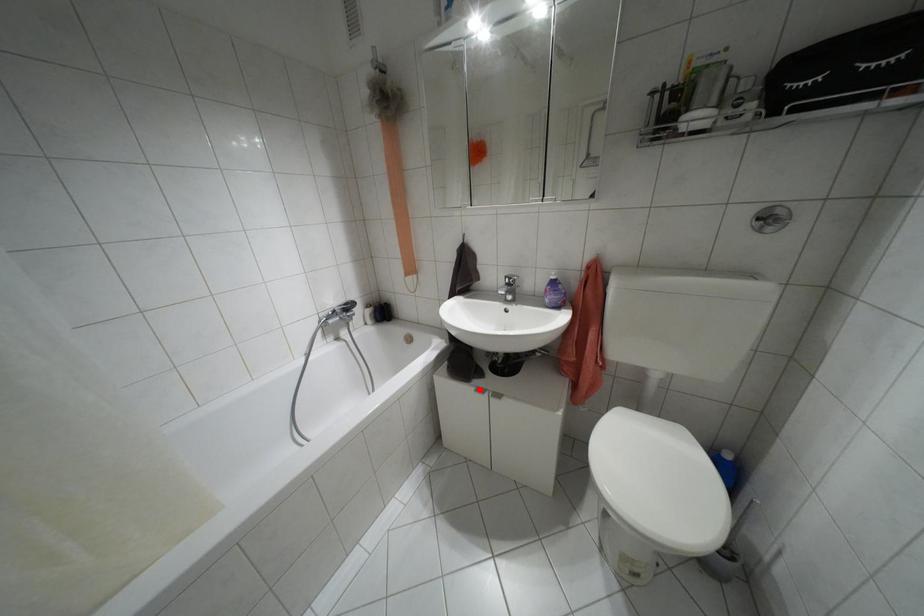
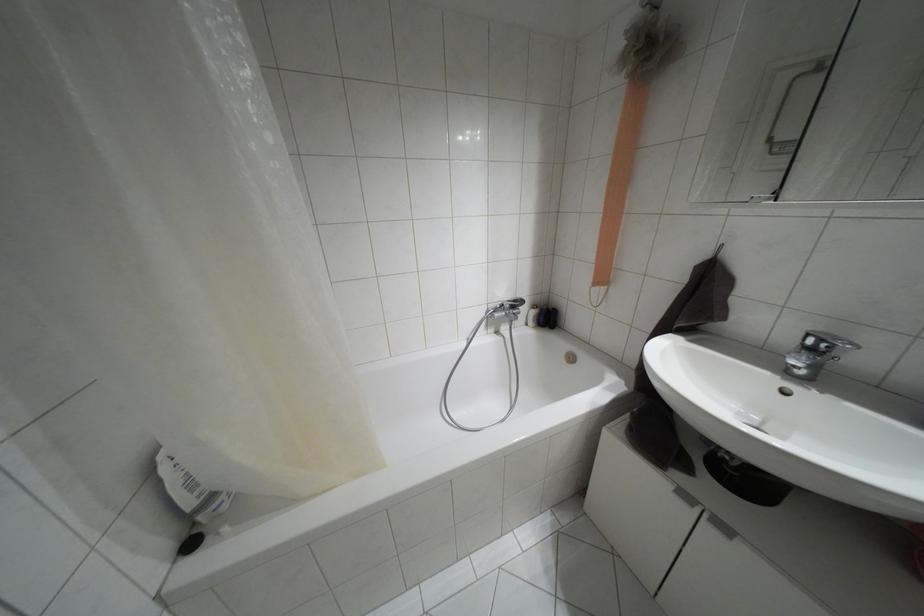
In the second image, find the point that corresponds to the highlighted location in the first image.

(685, 496)